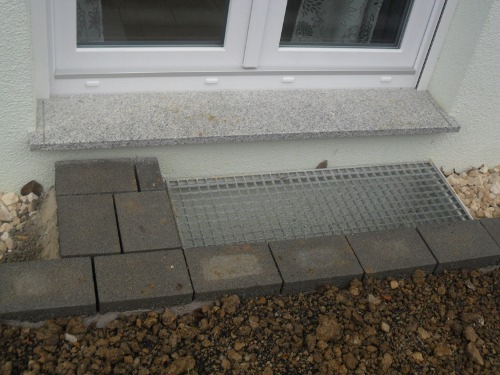
Locate an element on the screen. The image size is (500, 375). window ledge is located at coordinates (222, 116).